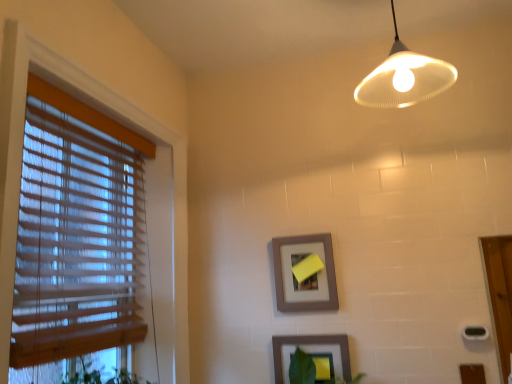
Question: Is wooden blinds at left touching matte gray picture frame at center, the second picture frame from the bottom?

Choices:
 (A) yes
 (B) no

Answer: (B)

Question: From the image's perspective, is wooden blinds at left on top of matte gray picture frame at center, the second picture frame from the bottom?

Choices:
 (A) no
 (B) yes

Answer: (B)

Question: Is wooden blinds at left to the left of matte gray picture frame at center, the second picture frame from the bottom, from the viewer's perspective?

Choices:
 (A) no
 (B) yes

Answer: (B)

Question: From the image's perspective, is wooden blinds at left under matte gray picture frame at center, the second picture frame from the bottom?

Choices:
 (A) no
 (B) yes

Answer: (A)

Question: Is wooden blinds at left oriented towards matte gray picture frame at center, the 1th picture frame from the top?

Choices:
 (A) no
 (B) yes

Answer: (B)

Question: From the image's perspective, is matte white lampshade at upper center positioned above or below wooden blinds at left?

Choices:
 (A) above
 (B) below

Answer: (A)

Question: Considering the positions of matte white lampshade at upper center and wooden blinds at left in the image, is matte white lampshade at upper center bigger or smaller than wooden blinds at left?

Choices:
 (A) small
 (B) big

Answer: (A)

Question: Would you say matte white lampshade at upper center is to the left or to the right of wooden blinds at left in the picture?

Choices:
 (A) right
 (B) left

Answer: (A)

Question: Is point (386, 77) positioned closer to the camera than point (79, 286)?

Choices:
 (A) farther
 (B) closer

Answer: (B)

Question: Does point (330, 342) appear closer or farther from the camera than point (303, 246)?

Choices:
 (A) closer
 (B) farther

Answer: (A)

Question: From a real-world perspective, is matte gray picture frame at lower center, the second picture frame from the top, above or below matte gray picture frame at center, the 1th picture frame from the top?

Choices:
 (A) above
 (B) below

Answer: (B)

Question: Is matte gray picture frame at lower center, the second picture frame from the top, in front of or behind matte gray picture frame at center, the second picture frame from the bottom, in the image?

Choices:
 (A) behind
 (B) front

Answer: (B)

Question: From the image's perspective, is matte gray picture frame at lower center, the second picture frame from the top, above or below matte gray picture frame at center, the 1th picture frame from the top?

Choices:
 (A) below
 (B) above

Answer: (A)

Question: In terms of width, does matte gray picture frame at center, the second picture frame from the bottom, look wider or thinner when compared to wooden blinds at left?

Choices:
 (A) thin
 (B) wide

Answer: (A)

Question: From a real-world perspective, is matte gray picture frame at center, the second picture frame from the bottom, positioned above or below wooden blinds at left?

Choices:
 (A) above
 (B) below

Answer: (B)